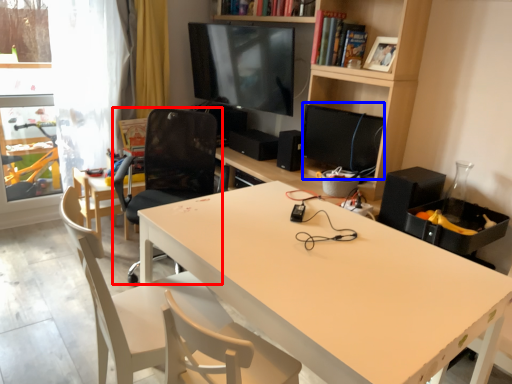
Question: Among these objects, which one is farthest to the camera, chair (highlighted by a red box) or computer monitor (highlighted by a blue box)?

Choices:
 (A) chair
 (B) computer monitor

Answer: (B)